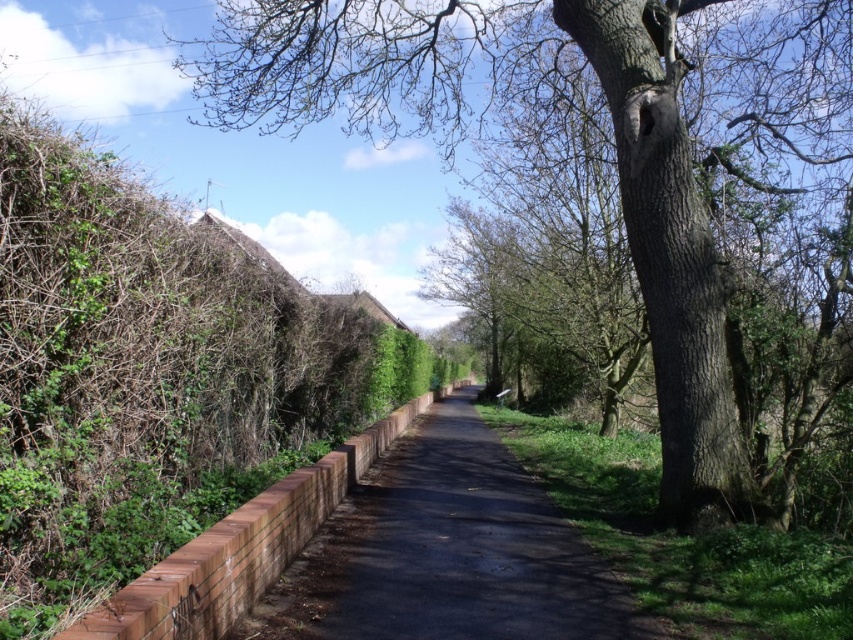
You are a pedestrian walking along the road and want to take a photo of the green leafy hedge at left and the brown rough bark tree at upper right. Which object should you position yourself closer to in order to capture both in a single frame?

You should position yourself closer to the green leafy hedge at left because the brown rough bark tree at upper right is to the right of the green leafy hedge at left, so keeping closer to the hedge will allow both objects to be within the camera frame.

You are a painter standing at the start of the road. You want to paint the brick wall at center first before moving to the brown rough bark tree at upper right. Which object should you paint first based on their positions?

You should paint the brick wall at center first because it is closer to you than the brown rough bark tree at upper right, which is further away.

You are standing at the starting point of the road and want to reach a destination located at point (42,460). There is an obstacle at point (701,131). Can you walk straight ahead without encountering the obstacle?

The obstacle at point (701,131) is further to the camera than the destination at point (42,460), so you will reach the destination before encountering the obstacle. Therefore, you can walk straight ahead without any issues.